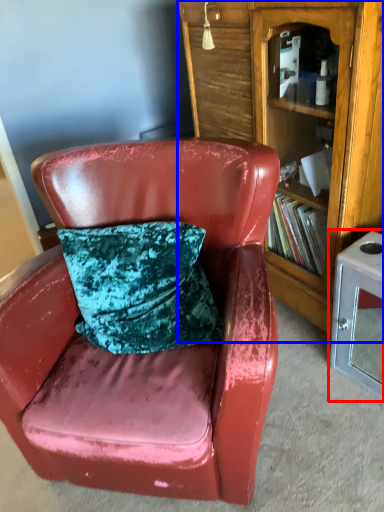
Question: Which point is closer to the camera, table (highlighted by a red box) or bookcase (highlighted by a blue box)?

Choices:
 (A) table
 (B) bookcase

Answer: (B)